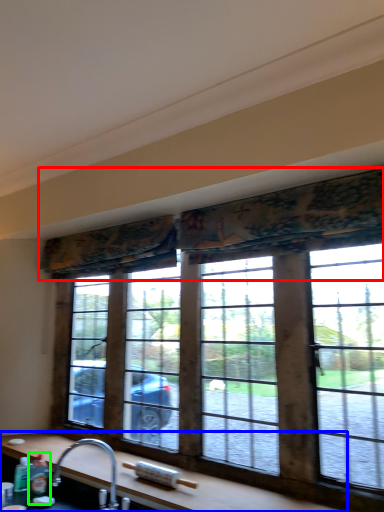
Question: Which is nearer to the curtain (highlighted by a red box)? counter top (highlighted by a blue box) or bottle (highlighted by a green box).

Choices:
 (A) counter top
 (B) bottle

Answer: (A)